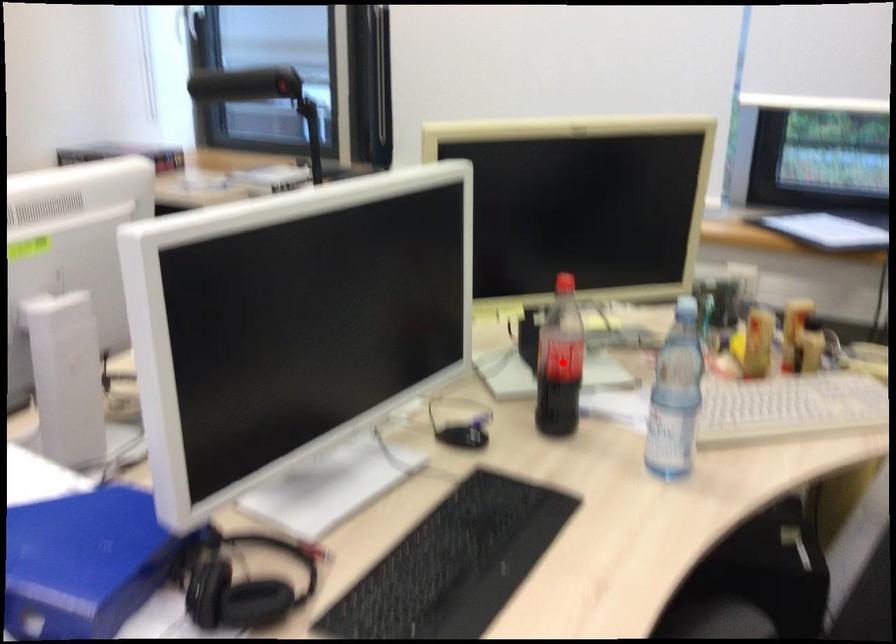
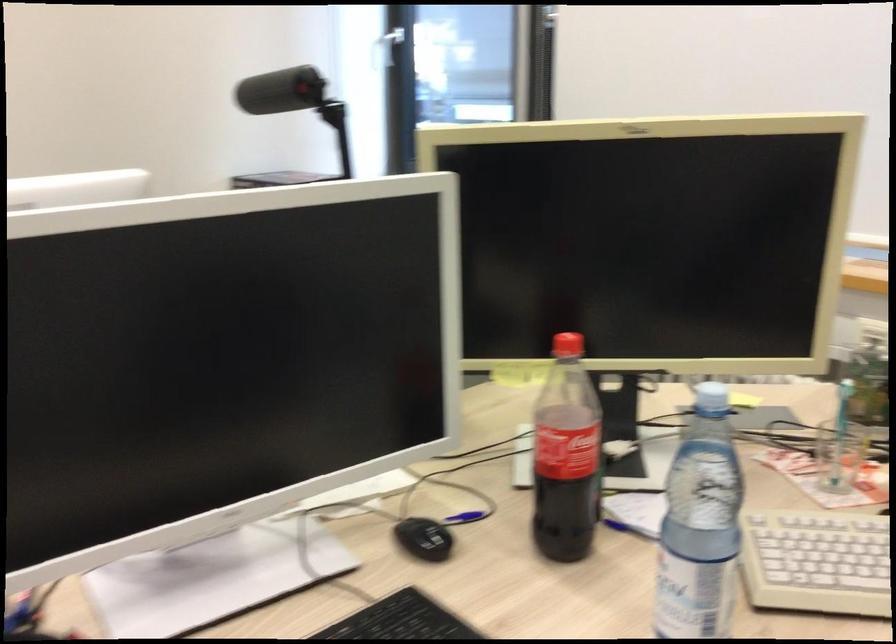
Locate, in the second image, the point that corresponds to the highlighted location in the first image.

(565, 456)